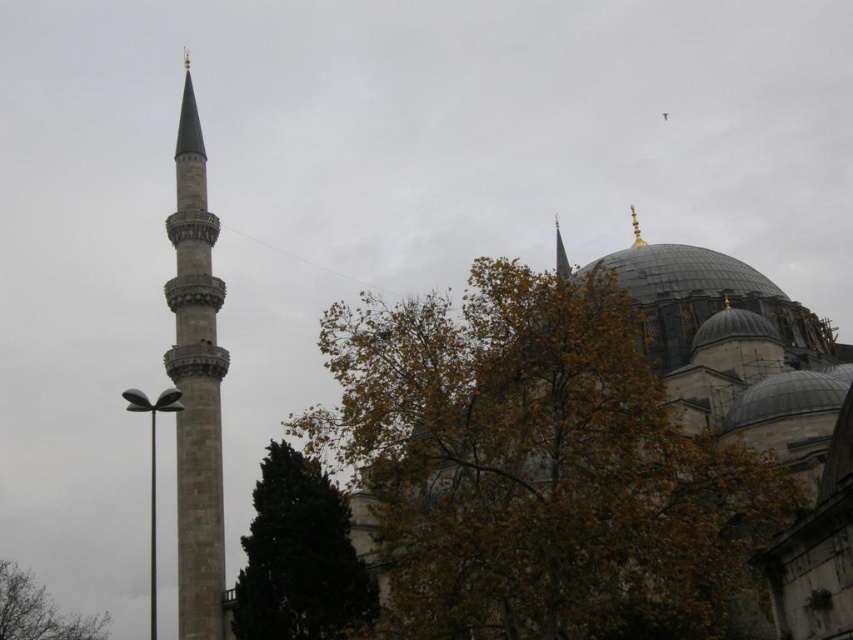
Is gray stone minaret at left closer to camera compared to gold metallic spire at upper center?

Yes, it is.

Between point (184, 301) and point (633, 224), which one is positioned in front?

Point (184, 301) is in front.

Identify the location of gray stone minaret at left. The width and height of the screenshot is (853, 640). (196, 384).

Who is positioned more to the right, brown leafy tree at center or dark green coniferous tree at lower center?

Positioned to the right is brown leafy tree at center.

Is brown leafy tree at center taller than dark green coniferous tree at lower center?

Yes, brown leafy tree at center is taller than dark green coniferous tree at lower center.

Is point (397, 492) positioned in front of point (321, 564)?

Yes, it is.

Locate an element on the screen. This screenshot has height=640, width=853. brown leafy tree at center is located at coordinates (538, 465).

Can you confirm if brown leafy tree at center is thinner than gold polished spire at upper center?

In fact, brown leafy tree at center might be wider than gold polished spire at upper center.

Consider the image. Who is more forward, (740, 577) or (567, 264)?

Point (740, 577) is in front.

At what (x,y) coordinates should I click in order to perform the action: click on brown leafy tree at center. Please return your answer as a coordinate pair (x, y). Looking at the image, I should click on (538, 465).